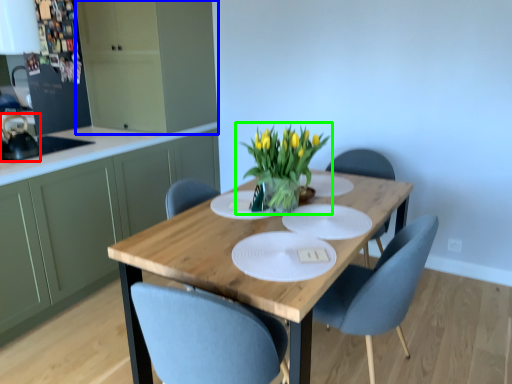
Question: Which object is the closest to the appliance (highlighted by a red box)? Choose among these: cabinetry (highlighted by a blue box) or houseplant (highlighted by a green box).

Choices:
 (A) cabinetry
 (B) houseplant

Answer: (A)